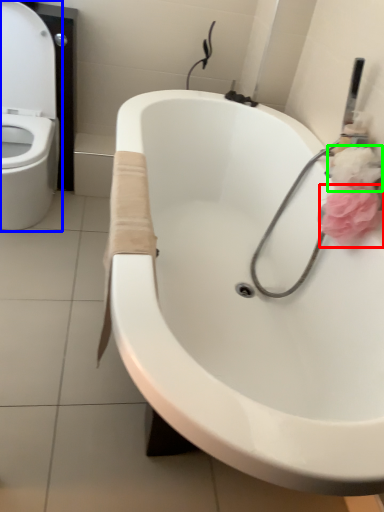
Question: Considering the real-world distances, which object is farthest from flower (highlighted by a red box)? toilet (highlighted by a blue box) or flower (highlighted by a green box)?

Choices:
 (A) toilet
 (B) flower

Answer: (A)